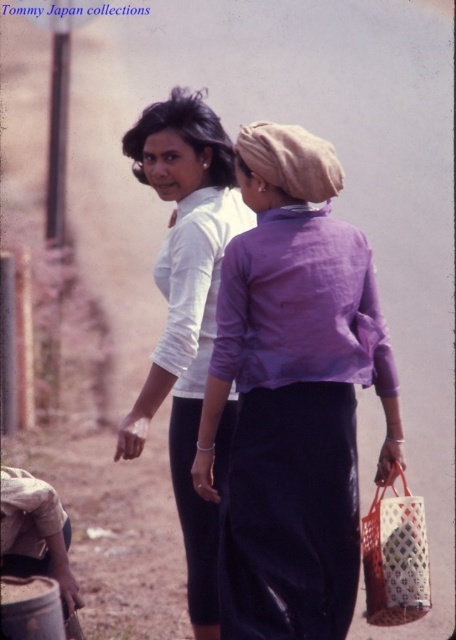
Question: Which point is closer to the camera?

Choices:
 (A) coord(149,403)
 (B) coord(304,184)
 (C) coord(368,614)

Answer: (B)

Question: Can you confirm if purple cotton shirt at center is positioned to the right of matte white blouse at center?

Choices:
 (A) yes
 (B) no

Answer: (A)

Question: Does matte white blouse at center have a lesser width compared to white woven basket at lower right?

Choices:
 (A) yes
 (B) no

Answer: (B)

Question: Which object is closer to the camera taking this photo?

Choices:
 (A) white woven basket at lower right
 (B) matte white blouse at center

Answer: (A)

Question: Is purple cotton shirt at center closer to the viewer compared to white woven basket at lower right?

Choices:
 (A) yes
 (B) no

Answer: (A)

Question: Estimate the real-world distances between objects in this image. Which object is closer to the white woven basket at lower right?

Choices:
 (A) matte white blouse at center
 (B) purple cotton shirt at center

Answer: (B)